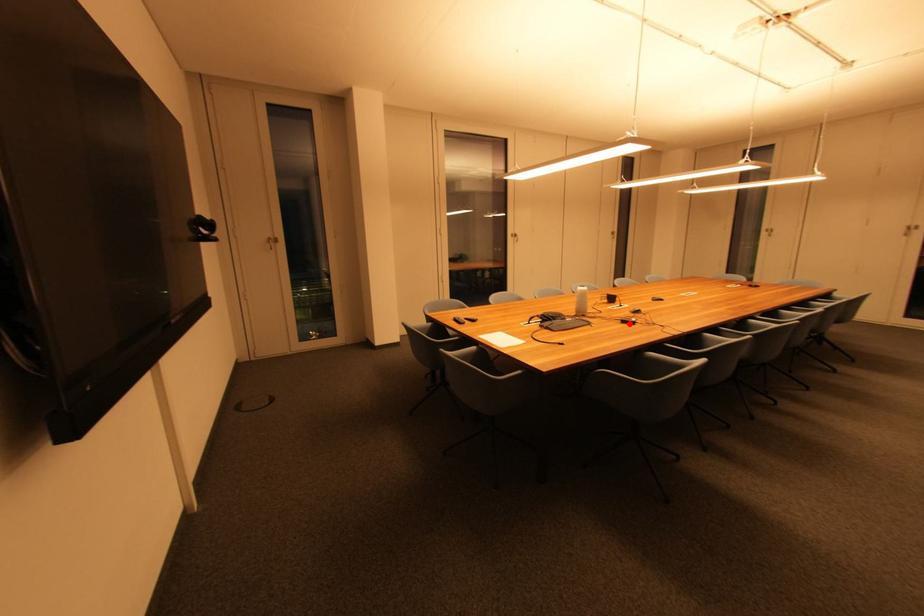
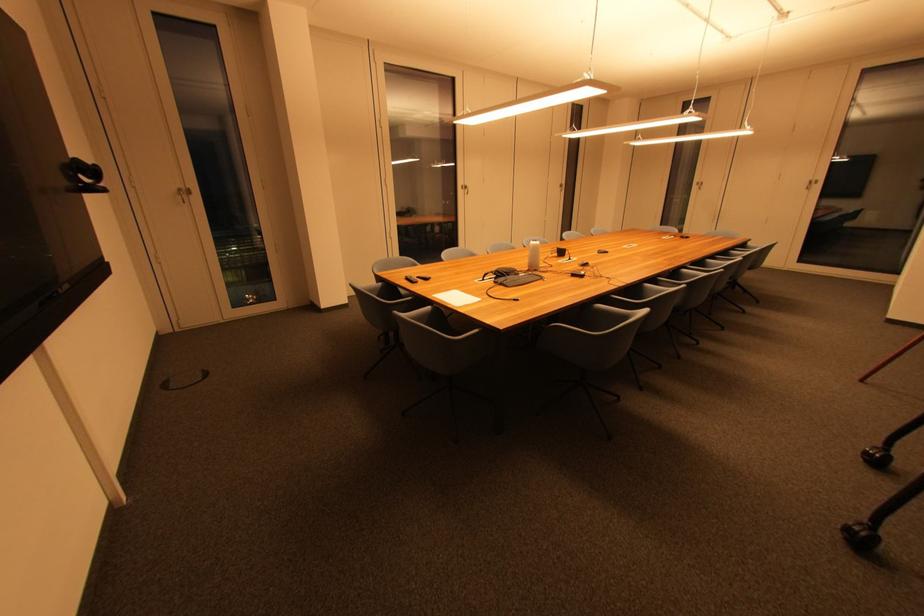
Find the pixel in the second image that matches the highlighted location in the first image.

(578, 277)